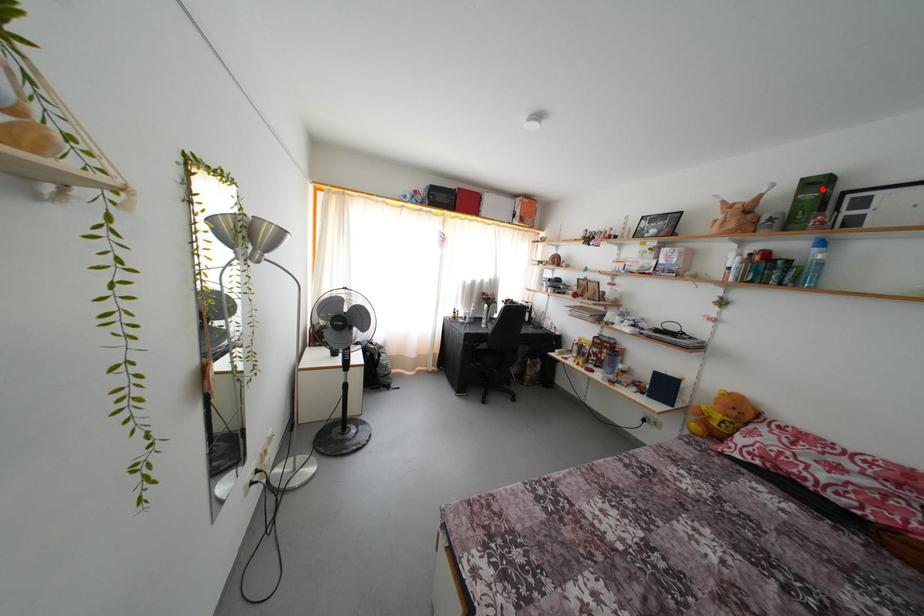
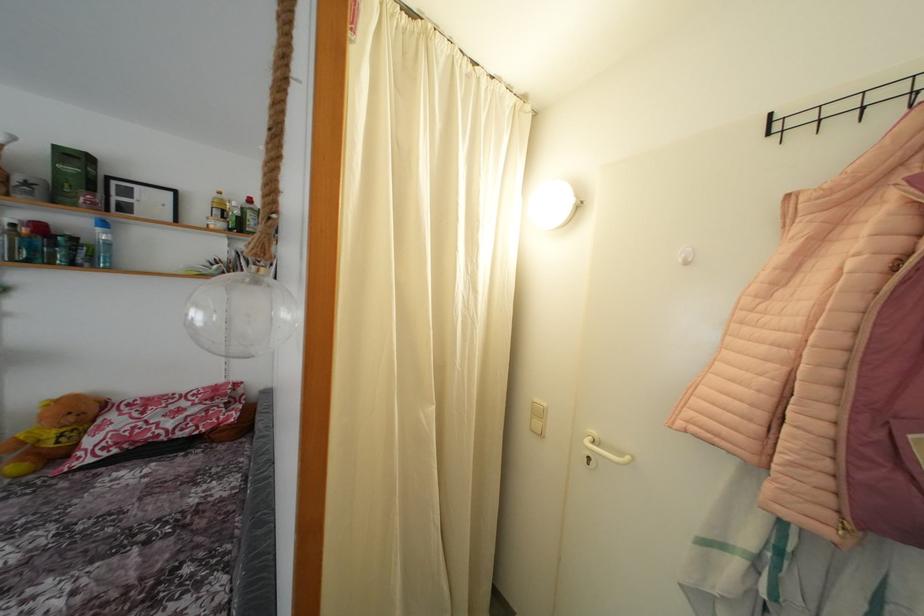
The point at the highlighted location is marked in the first image. Where is the corresponding point in the second image?

(80, 163)